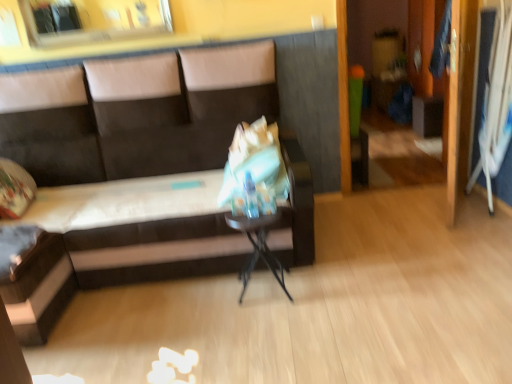
Identify the location of metallic silver table at center. (258, 246).

The width and height of the screenshot is (512, 384). Describe the element at coordinates (258, 246) in the screenshot. I see `metallic silver table at center` at that location.

Where is `dark brown leather couch at center`? The height and width of the screenshot is (384, 512). dark brown leather couch at center is located at coordinates (135, 234).

This screenshot has height=384, width=512. What do you see at coordinates (135, 234) in the screenshot? I see `dark brown leather couch at center` at bounding box center [135, 234].

You are a GUI agent. You are given a task and a screenshot of the screen. Output one action in this format:
    pyautogui.click(x=<x>, y=<y>)
    Task: Click on the metallic silver table at center
    This screenshot has height=384, width=512.
    Given the screenshot: What is the action you would take?
    pyautogui.click(x=258, y=246)

Considering the positions of objects metallic silver table at center and dark brown leather couch at center in the image provided, who is more to the left, metallic silver table at center or dark brown leather couch at center?

dark brown leather couch at center.

In the image, is metallic silver table at center positioned in front of or behind dark brown leather couch at center?

In the image, metallic silver table at center appears behind dark brown leather couch at center.

Considering the points (253, 254) and (108, 186), which point is in front, point (253, 254) or point (108, 186)?

Point (253, 254)

Consider the image. From the image's perspective, is metallic silver table at center located above or below dark brown leather couch at center?

metallic silver table at center is situated lower than dark brown leather couch at center in the image.

From a real-world perspective, is metallic silver table at center on dark brown leather couch at center?

No, from a real-world perspective, metallic silver table at center is not above dark brown leather couch at center.

Considering the relative sizes of metallic silver table at center and dark brown leather couch at center in the image provided, is metallic silver table at center wider than dark brown leather couch at center?

No.

Considering the sizes of objects metallic silver table at center and dark brown leather couch at center in the image provided, who is taller, metallic silver table at center or dark brown leather couch at center?

Standing taller between the two is dark brown leather couch at center.

Does metallic silver table at center have a smaller size compared to dark brown leather couch at center?

Correct, metallic silver table at center occupies less space than dark brown leather couch at center.

Can dark brown leather couch at center be found inside metallic silver table at center?

Actually, dark brown leather couch at center is outside metallic silver table at center.

Is there a large distance between metallic silver table at center and dark brown leather couch at center?

That's not correct — metallic silver table at center is a little close to dark brown leather couch at center.

Is dark brown leather couch at center at the back of metallic silver table at center?

Yes, metallic silver table at center is positioned with its back facing dark brown leather couch at center.

Based on the photo, how far apart are metallic silver table at center and dark brown leather couch at center?

metallic silver table at center is 26.65 inches away from dark brown leather couch at center.

Where is `studio couch lying above the metallic silver table at center (from the image's perspective)`? studio couch lying above the metallic silver table at center (from the image's perspective) is located at coordinates (135, 234).

Between dark brown leather couch at center and metallic silver table at center, which one appears on the right side from the viewer's perspective?

From the viewer's perspective, metallic silver table at center appears more on the right side.

Considering their positions, is dark brown leather couch at center located in front of or behind metallic silver table at center?

Visually, dark brown leather couch at center is located in front of metallic silver table at center.

Is point (135, 259) positioned before point (253, 266)?

That is True.

From the image's perspective, which one is positioned higher, dark brown leather couch at center or metallic silver table at center?

dark brown leather couch at center, from the image's perspective.

From a real-world perspective, is dark brown leather couch at center located higher than metallic silver table at center?

Yes, from a real-world perspective, dark brown leather couch at center is over metallic silver table at center

Considering the sizes of dark brown leather couch at center and metallic silver table at center in the image, is dark brown leather couch at center wider or thinner than metallic silver table at center?

In the image, dark brown leather couch at center appears to be wider than metallic silver table at center.

Does dark brown leather couch at center have a greater height compared to metallic silver table at center?

Indeed, dark brown leather couch at center has a greater height compared to metallic silver table at center.

Considering the sizes of dark brown leather couch at center and metallic silver table at center in the image, is dark brown leather couch at center bigger or smaller than metallic silver table at center?

Clearly, dark brown leather couch at center is larger in size than metallic silver table at center.

Is dark brown leather couch at center inside the boundaries of metallic silver table at center, or outside?

The correct answer is: outside.

Is there a large distance between dark brown leather couch at center and metallic silver table at center?

No, there isn't a large distance between dark brown leather couch at center and metallic silver table at center.

Is dark brown leather couch at center positioned with its back to metallic silver table at center?

No.

How many degrees apart are the facing directions of dark brown leather couch at center and metallic silver table at center?

They differ by 1.24 degrees in their facing directions.

At what (x,y) coordinates should I click in order to perform the action: click on table lying below the dark brown leather couch at center (from the image's perspective). Please return your answer as a coordinate pair (x, y). The height and width of the screenshot is (384, 512). Looking at the image, I should click on (258, 246).

Find the location of a particular element. This screenshot has height=384, width=512. studio couch above the metallic silver table at center (from a real-world perspective) is located at coordinates (135, 234).

Where is `table on the right of the dark brown leather couch at center`? table on the right of the dark brown leather couch at center is located at coordinates (258, 246).